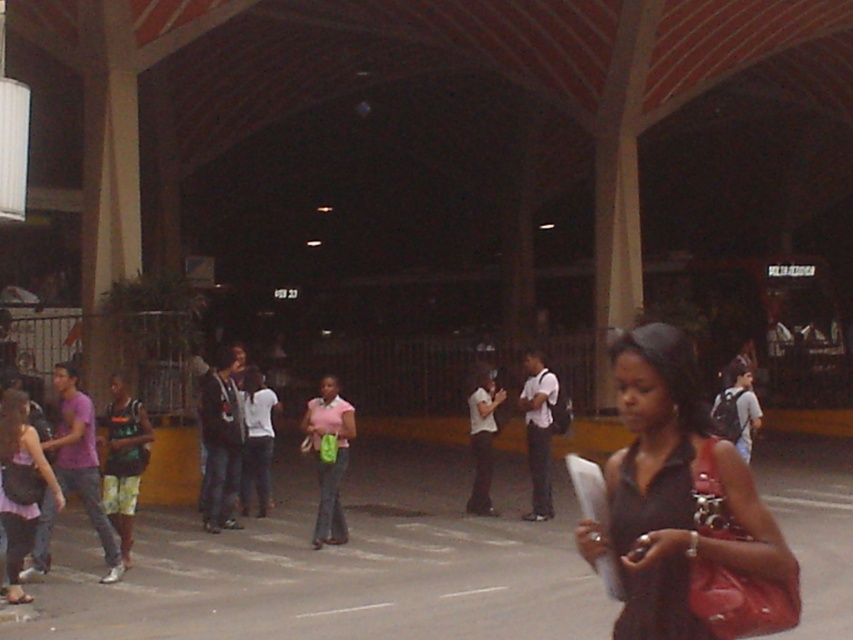
Question: Is the position of matte black dress at center more distant than that of matte pink skirt at lower left?

Choices:
 (A) yes
 (B) no

Answer: (B)

Question: Which point is farther from the camera taking this photo?

Choices:
 (A) (608, 480)
 (B) (24, 435)

Answer: (B)

Question: Which point appears farthest from the camera in this image?

Choices:
 (A) (698, 483)
 (B) (9, 417)

Answer: (B)

Question: Is matte black dress at center to the right of matte pink skirt at lower left from the viewer's perspective?

Choices:
 (A) no
 (B) yes

Answer: (B)

Question: Observing the image, what is the correct spatial positioning of matte black dress at center in reference to matte pink skirt at lower left?

Choices:
 (A) below
 (B) above

Answer: (B)